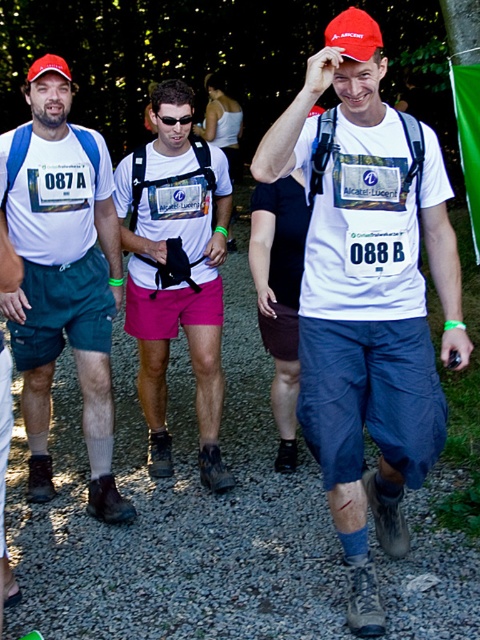
Question: Which object is closer to the camera taking this photo?

Choices:
 (A) matte blue shorts at left
 (B) pink fabric shorts at center
 (C) white matte t-shirt at center

Answer: (C)

Question: Is white matte t-shirt at center to the right of matte blue shorts at left from the viewer's perspective?

Choices:
 (A) yes
 (B) no

Answer: (A)

Question: Among these points, which one is farthest from the camera?

Choices:
 (A) (406, 248)
 (B) (146, 188)
 (C) (97, 172)

Answer: (B)

Question: Can you confirm if white matte t-shirt at center is positioned to the right of pink fabric shorts at center?

Choices:
 (A) yes
 (B) no

Answer: (A)

Question: Does white matte t-shirt at center have a greater width compared to pink fabric shorts at center?

Choices:
 (A) yes
 (B) no

Answer: (A)

Question: Estimate the real-world distances between objects in this image. Which object is closer to the pink fabric shorts at center?

Choices:
 (A) matte blue shorts at left
 (B) white matte t-shirt at center

Answer: (A)